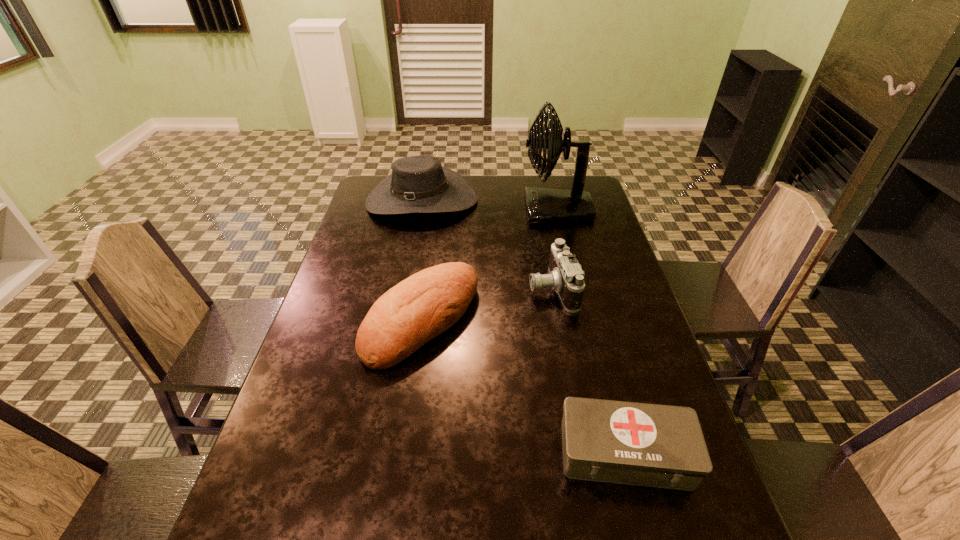
Where is `vacant space located at the lens of the camera`? vacant space located at the lens of the camera is located at coordinates (407, 288).

Find the location of a particular element. The width and height of the screenshot is (960, 540). free space located 0.130m at the lens of the camera is located at coordinates (485, 288).

Identify the location of vacant space located at the lens of the camera. (465, 288).

At what (x,y) coordinates should I click in order to perform the action: click on vacant space located on the back of the bread. Please return your answer as a coordinate pair (x, y). The height and width of the screenshot is (540, 960). Looking at the image, I should click on (434, 227).

You are a GUI agent. You are given a task and a screenshot of the screen. Output one action in this format:
    pyautogui.click(x=<x>, y=<y>)
    Task: Click on the vacant region located on the left of the nearest object
    
    Given the screenshot: What is the action you would take?
    pyautogui.click(x=483, y=453)

Locate an element on the screen. fan that is positioned at the far edge is located at coordinates (544, 206).

The image size is (960, 540). What are the coordinates of `cowboy hat that is positioned at the far edge` in the screenshot? It's located at (418, 184).

Find the location of `cowboy hat that is at the left edge`. cowboy hat that is at the left edge is located at coordinates (418, 184).

Where is `bread present at the left edge`? The width and height of the screenshot is (960, 540). bread present at the left edge is located at coordinates (429, 302).

The image size is (960, 540). In order to click on fan that is positioned at the right edge in this screenshot , I will do `click(544, 206)`.